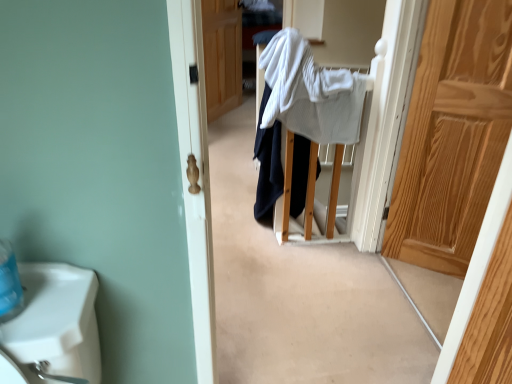
In order to click on white textured bath towel at center in this screenshot , I will do `click(310, 92)`.

The height and width of the screenshot is (384, 512). What do you see at coordinates (452, 135) in the screenshot?
I see `light brown wooden door at right, the first door from the front` at bounding box center [452, 135].

The height and width of the screenshot is (384, 512). What do you see at coordinates (222, 56) in the screenshot?
I see `wooden door at center, the first door positioned from the left` at bounding box center [222, 56].

I want to click on white textured bath towel at center, so click(x=310, y=92).

What's the angular difference between white textured bath towel at center and white cotton sweater at center's facing directions?

The facing directions of white textured bath towel at center and white cotton sweater at center are 89.3 degrees apart.

Is white textured bath towel at center to the right of white cotton sweater at center from the viewer's perspective?

Yes.

Who is bigger, white textured bath towel at center or white cotton sweater at center?

Bigger between the two is white textured bath towel at center.

Is white textured bath towel at center positioned far away from white cotton sweater at center?

→ They are positioned close to each other.

From the image's perspective, which object appears higher, wooden door at center, which appears as the first door when viewed from the back, or white textured bath towel at center?

wooden door at center, which appears as the first door when viewed from the back, is shown above in the image.

This screenshot has width=512, height=384. Find the location of `bath towel in front of the wooden door at center, the second door from the front`. bath towel in front of the wooden door at center, the second door from the front is located at coordinates (310, 92).

Based on the photo, is wooden door at center, the first door positioned from the left, touching white textured bath towel at center?

No, wooden door at center, the first door positioned from the left, is not next to white textured bath towel at center.

Considering the sizes of objects wooden door at center, the second door from the front, and white textured bath towel at center in the image provided, who is smaller, wooden door at center, the second door from the front, or white textured bath towel at center?

With smaller size is wooden door at center, the second door from the front.

In the image, is wooden door at center, the second door viewed from the right, positioned in front of or behind light brown wooden door at right, which appears as the 1th door when ordered from the bottom?

Visually, wooden door at center, the second door viewed from the right, is located behind light brown wooden door at right, which appears as the 1th door when ordered from the bottom.

Are wooden door at center, the first door positioned from the top, and light brown wooden door at right, which is the 2th door in top-to-bottom order, far apart?

Yes.

The height and width of the screenshot is (384, 512). In order to click on door on the left of light brown wooden door at right, placed as the first door when sorted from right to left in this screenshot , I will do `click(222, 56)`.

From the image's perspective, which one is positioned higher, white cotton sweater at center or light brown wooden door at right, positioned as the 2th door in back-to-front order?

light brown wooden door at right, positioned as the 2th door in back-to-front order, from the image's perspective.

Which is less distant, (x=305, y=138) or (x=442, y=153)?

The point (x=442, y=153) is more forward.

Is white cotton sweater at center turned away from light brown wooden door at right, acting as the 2th door starting from the left?

white cotton sweater at center is not turned away from light brown wooden door at right, acting as the 2th door starting from the left.

How much distance is there between white cotton sweater at center and light brown wooden door at right, placed as the first door when sorted from right to left?

They are 27.56 inches apart.

Is white textured bath towel at center at the back of light brown wooden door at right, acting as the 2th door starting from the left?

No, light brown wooden door at right, acting as the 2th door starting from the left, is not facing the opposite direction of white textured bath towel at center.

Is light brown wooden door at right, placed as the first door when sorted from right to left, positioned before white textured bath towel at center?

That is True.

Is light brown wooden door at right, which is the 2th door in top-to-bottom order, to the left or to the right of white textured bath towel at center in the image?

Based on their positions, light brown wooden door at right, which is the 2th door in top-to-bottom order, is located to the right of white textured bath towel at center.

From a real-world perspective, which is physically above, light brown wooden door at right, the first door from the front, or white textured bath towel at center?

white textured bath towel at center, from a real-world perspective.

Locate an element on the screen. door on the right of white cotton sweater at center is located at coordinates (452, 135).

Between light brown wooden door at right, positioned as the 2th door in back-to-front order, and white cotton sweater at center, which one has smaller size?

Smaller between the two is light brown wooden door at right, positioned as the 2th door in back-to-front order.

In the image, is light brown wooden door at right, which appears as the 1th door when ordered from the bottom, on the left side or the right side of white cotton sweater at center?

In the image, light brown wooden door at right, which appears as the 1th door when ordered from the bottom, appears on the right side of white cotton sweater at center.

Is white cotton sweater at center to the right of wooden door at center, the first door positioned from the left, from the viewer's perspective?

Yes.

Considering the sizes of objects white cotton sweater at center and wooden door at center, which appears as the first door when viewed from the back, in the image provided, who is wider, white cotton sweater at center or wooden door at center, which appears as the first door when viewed from the back,?

white cotton sweater at center.

Is white cotton sweater at center turned away from wooden door at center, the second door viewed from the right?

No, wooden door at center, the second door viewed from the right, is not at the back of white cotton sweater at center.

From a real-world perspective, is white cotton sweater at center beneath wooden door at center, the second door viewed from the right?

Yes, from a real-world perspective, white cotton sweater at center is below wooden door at center, the second door viewed from the right.

Find the location of `clothing that appears on the left of white textured bath towel at center`. clothing that appears on the left of white textured bath towel at center is located at coordinates (268, 165).

Where is `door behind the white textured bath towel at center`? Image resolution: width=512 pixels, height=384 pixels. door behind the white textured bath towel at center is located at coordinates (222, 56).

Which object lies further to the anchor point light brown wooden door at right, which is the 2th door in top-to-bottom order, white textured bath towel at center or wooden door at center, positioned as the second door in bottom-to-top order?

Among the two, wooden door at center, positioned as the second door in bottom-to-top order, is located further to light brown wooden door at right, which is the 2th door in top-to-bottom order.

Considering their positions, is light brown wooden door at right, which appears as the 1th door when ordered from the bottom, positioned closer to white cotton sweater at center than wooden door at center, which appears as the first door when viewed from the back?

The object closer to white cotton sweater at center is light brown wooden door at right, which appears as the 1th door when ordered from the bottom.

From the image, which object appears to be nearer to light brown wooden door at right, which appears as the 1th door when ordered from the bottom, white textured bath towel at center or white cotton sweater at center?

white textured bath towel at center.

When comparing their distances from white cotton sweater at center, does white textured bath towel at center or wooden door at center, the first door positioned from the left, seem closer?

white textured bath towel at center lies closer to white cotton sweater at center than the other object.

Based on their spatial positions, is wooden door at center, the second door viewed from the right, or light brown wooden door at right, which is the 2th door in top-to-bottom order, further from white textured bath towel at center?

wooden door at center, the second door viewed from the right.

Looking at the image, which one is located further to white textured bath towel at center, white cotton sweater at center or light brown wooden door at right, the first door from the front?

light brown wooden door at right, the first door from the front, is further to white textured bath towel at center.

From the image, which object appears to be nearer to light brown wooden door at right, positioned as the 2th door in back-to-front order, wooden door at center, positioned as the second door in bottom-to-top order, or white textured bath towel at center?

Among the two, white textured bath towel at center is located nearer to light brown wooden door at right, positioned as the 2th door in back-to-front order.

Looking at the image, which one is located closer to white textured bath towel at center, light brown wooden door at right, acting as the 2th door starting from the left, or wooden door at center, positioned as the second door in bottom-to-top order?

The object closer to white textured bath towel at center is light brown wooden door at right, acting as the 2th door starting from the left.

Locate an element on the screen. This screenshot has height=384, width=512. clothing between light brown wooden door at right, placed as the first door when sorted from right to left, and wooden door at center, the second door from the front, from front to back is located at coordinates (268, 165).

At what (x,y) coordinates should I click in order to perform the action: click on clothing between white textured bath towel at center and wooden door at center, the second door viewed from the right, from front to back. Please return your answer as a coordinate pair (x, y). The height and width of the screenshot is (384, 512). Looking at the image, I should click on (268, 165).

I want to click on bath towel between white cotton sweater at center and light brown wooden door at right, which appears as the 1th door when ordered from the bottom, in the horizontal direction, so click(310, 92).

The image size is (512, 384). Find the location of `bath towel between light brown wooden door at right, which appears as the 1th door when ordered from the bottom, and wooden door at center, the second door from the front, from front to back`. bath towel between light brown wooden door at right, which appears as the 1th door when ordered from the bottom, and wooden door at center, the second door from the front, from front to back is located at coordinates (310, 92).